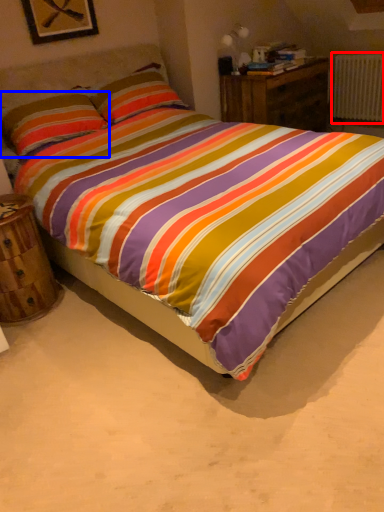
Question: Among these objects, which one is farthest to the camera, radiator (highlighted by a red box) or pillow (highlighted by a blue box)?

Choices:
 (A) radiator
 (B) pillow

Answer: (A)